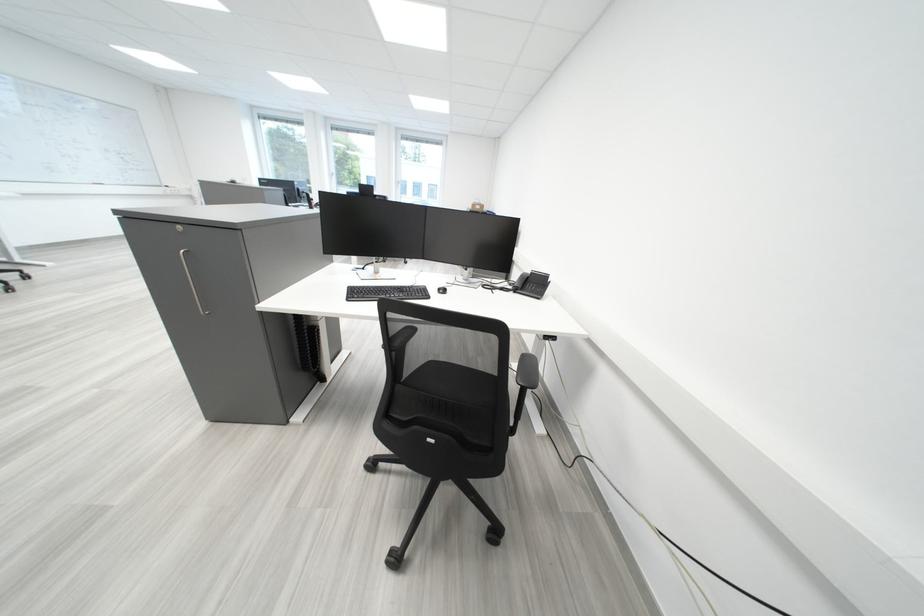
Locate an element on the screen. silver cabinet handle is located at coordinates (190, 282).